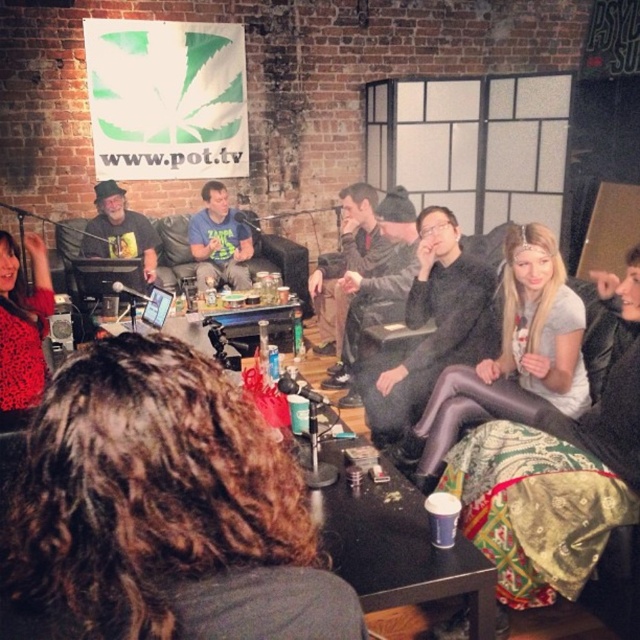
This screenshot has height=640, width=640. Identify the location of blue t-shirt at center. (220, 241).

Can you confirm if blue t-shirt at center is positioned to the left of matte black shirt at center?

Incorrect, blue t-shirt at center is not on the left side of matte black shirt at center.

This screenshot has width=640, height=640. Identify the location of blue t-shirt at center. (220, 241).

In the scene shown: Can you confirm if dark gray knit hat at center is positioned above shiny red sweater at lower left?

Indeed, dark gray knit hat at center is positioned over shiny red sweater at lower left.

Can you confirm if dark gray knit hat at center is wider than shiny red sweater at lower left?

In fact, dark gray knit hat at center might be narrower than shiny red sweater at lower left.

Where is `dark gray knit hat at center`? dark gray knit hat at center is located at coordinates (378, 285).

Is matte black jacket at center taller than shiny red sweater at lower left?

Yes, matte black jacket at center is taller than shiny red sweater at lower left.

Which is above, matte black jacket at center or shiny red sweater at lower left?

shiny red sweater at lower left is above.

The height and width of the screenshot is (640, 640). What do you see at coordinates (433, 326) in the screenshot? I see `matte black jacket at center` at bounding box center [433, 326].

Image resolution: width=640 pixels, height=640 pixels. I want to click on matte black jacket at center, so click(433, 326).